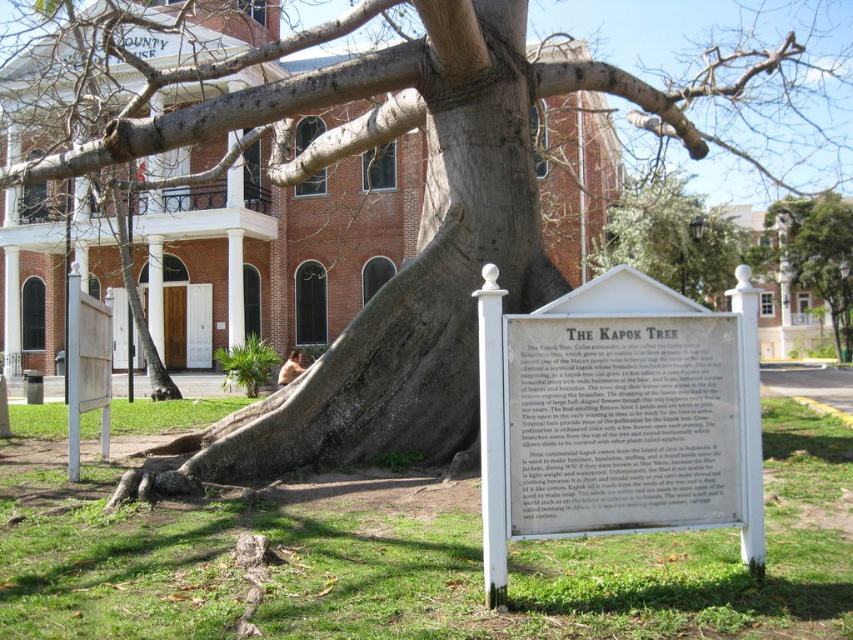
You are a painter who wants to capture the scene of the Kapok tree and the historic building in the background. You have a canvas that is 12 inches wide. If you want to include both the white wooden sign at center and the brick building at center, which object should you make narrower to fit them both on the canvas?

Since the white wooden sign at center is thinner than the brick building at center, you should make the brick building at center narrower to fit both on the canvas.

You are standing at the point labeled point (86, 48) and want to walk to the point labeled point (663, 355). Which direction should you move?

You should move forward because point (663, 355) is in front of point (86, 48).